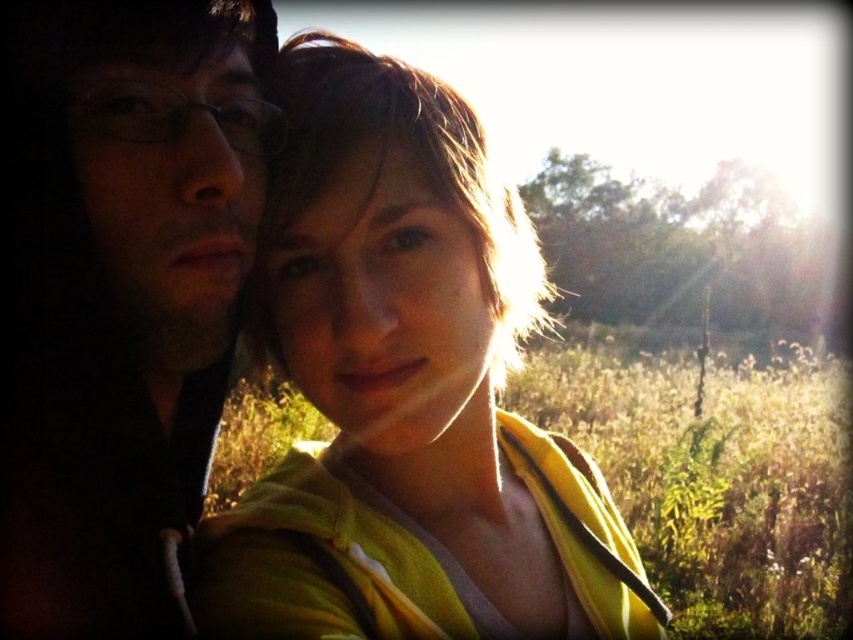
You are standing at the point marked as point (408, 392) in the image. What object is located exactly at that point?

The yellow fabric at center is located exactly at point (408, 392).

You are a photographer trying to capture a clear shot of the matte black hoodie at left and the yellow fabric at center. Which object should you focus on first if you want to ensure both are in focus without moving the camera?

The matte black hoodie at left is behind the yellow fabric at center. To ensure both are in focus, you should focus on the yellow fabric at center first since it is closer to the camera, allowing the matte black hoodie at left to be in focus as well through depth of field.